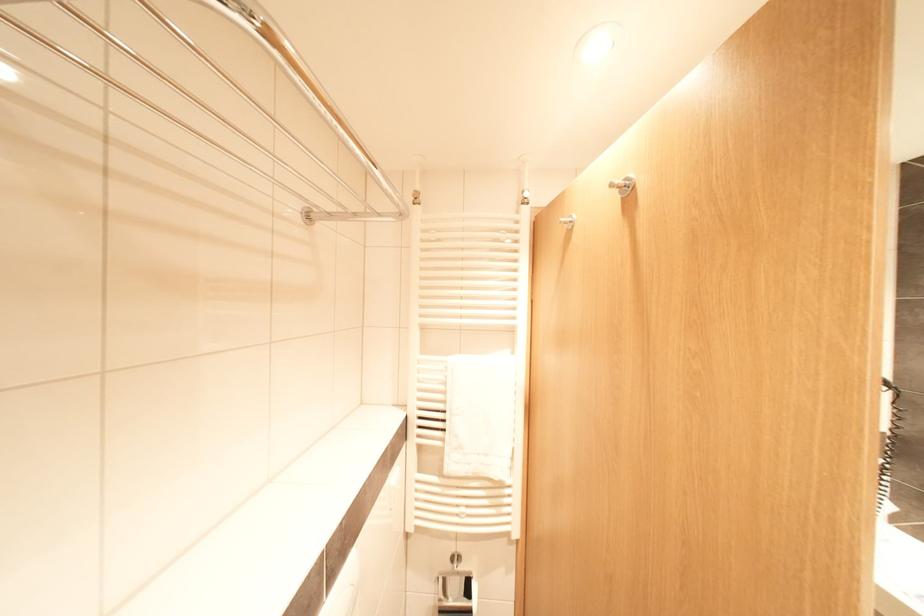
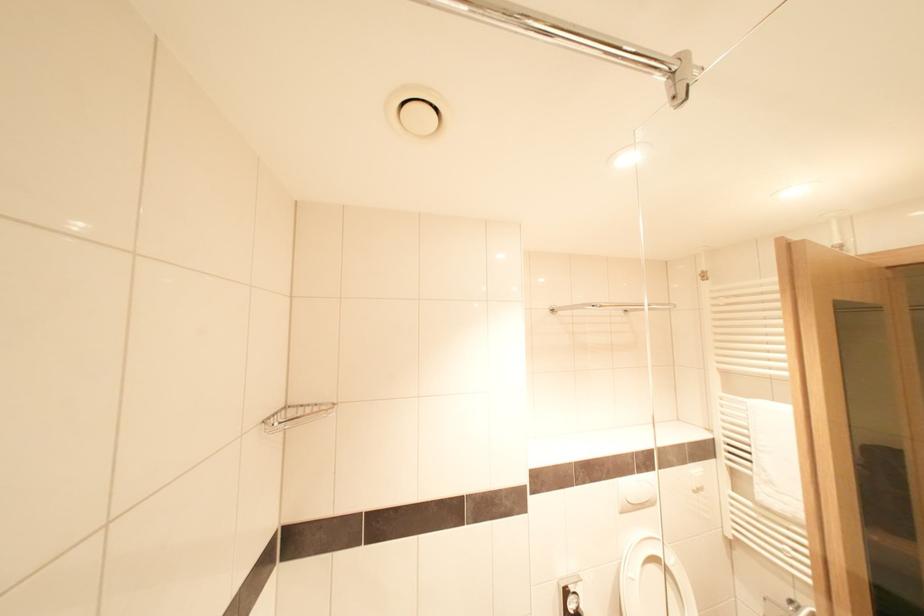
Question: The camera is either moving clockwise (left) or counter-clockwise (right) around the object. The first image is from the beginning of the video and the second image is from the end. Is the camera moving left or right when shooting the video?

Choices:
 (A) Left
 (B) Right

Answer: (B)